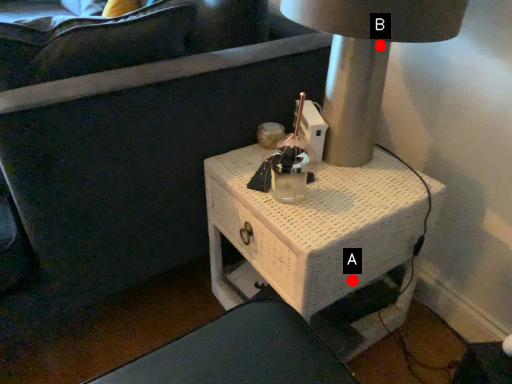
Question: Two points are circled on the image, labeled by A and B beside each circle. Which point appears closest to the camera in this image?

Choices:
 (A) A is closer
 (B) B is closer

Answer: (B)